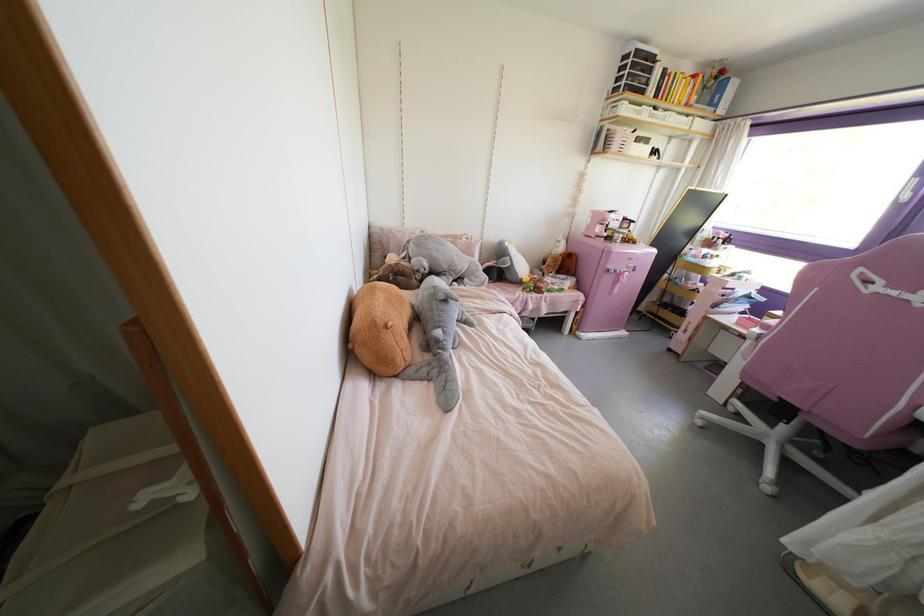
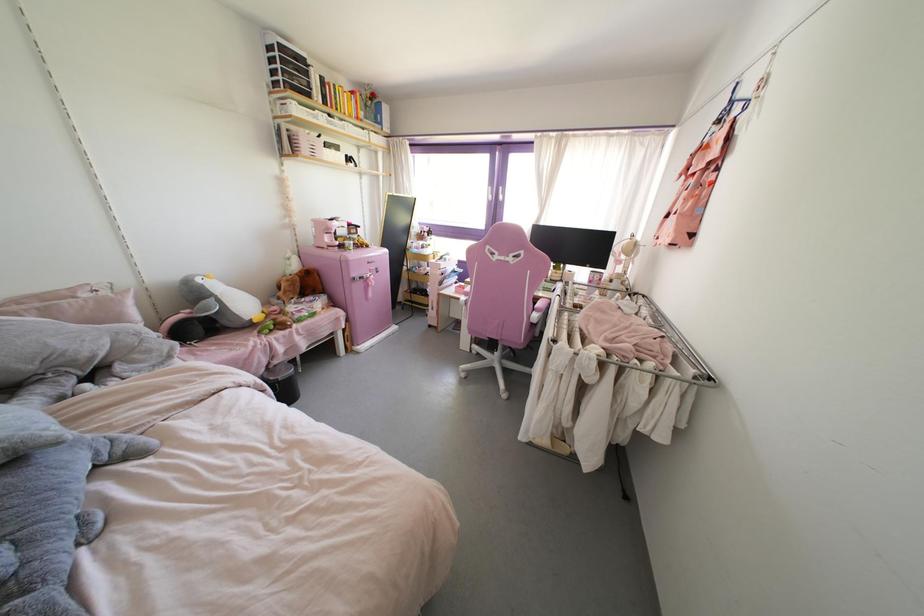
The point at [456,300] is marked in the first image. Where is the corresponding point in the second image?

(57, 442)